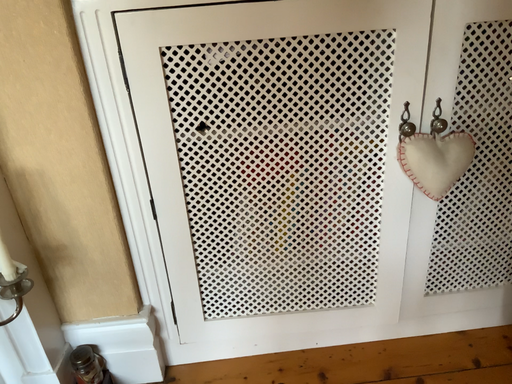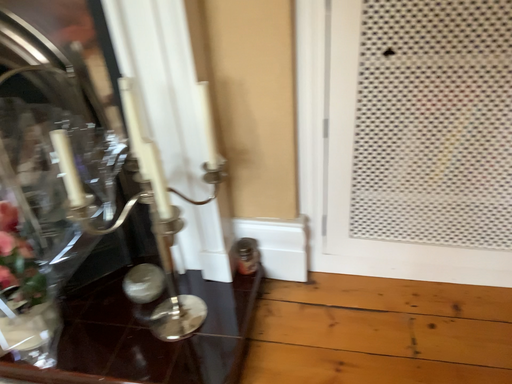
Question: Which way did the camera rotate in the video?

Choices:
 (A) rotated left
 (B) rotated right

Answer: (A)